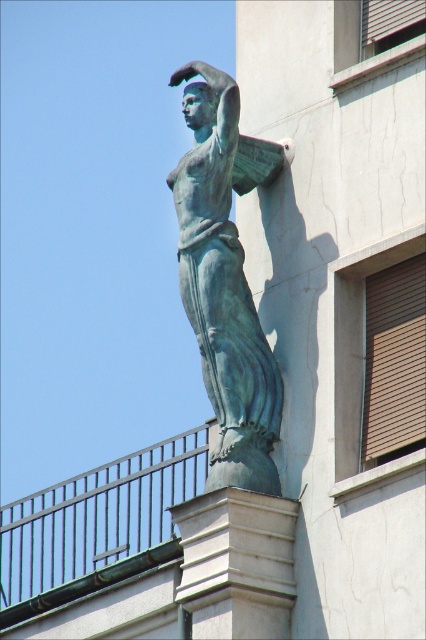
Based on the photo, you are an architect reviewing the building facade. You notice the green patina statue at upper center and the white stone column at center. Which object is taller?

The green patina statue at upper center is much taller than the white stone column at center.

You are an art student who wants to sketch the green patina statue at upper center and the white stone column at center. Which object should you focus on first to capture their relative positions accurately?

You should focus on the green patina statue at upper center first because it is closer to you than the white stone column at center, so it should be drawn in front of the column to show their correct spatial relationship.